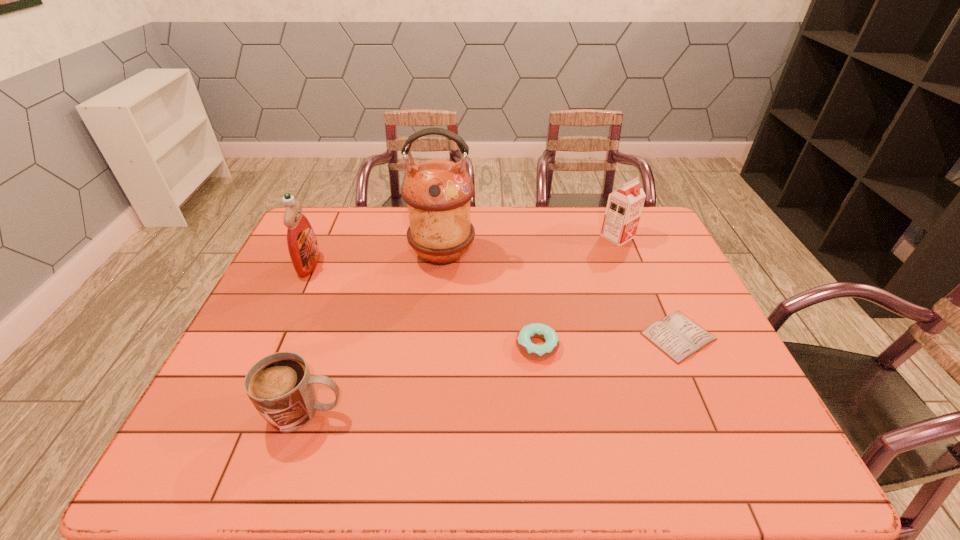
This screenshot has width=960, height=540. I want to click on object that can be found as the third closest to the fourth object from right to left, so click(280, 386).

The height and width of the screenshot is (540, 960). In order to click on vacant position in the image that satisfies the following two spatial constraints: 1. on the front surface of the doughnut; 2. on the left side of the leftmost object in this screenshot , I will do `click(271, 346)`.

Find the location of a particular element. free point that satisfies the following two spatial constraints: 1. on the front surface of the detergent; 2. on the left side of the shortest object is located at coordinates (276, 336).

This screenshot has height=540, width=960. I want to click on vacant area in the image that satisfies the following two spatial constraints: 1. on the back side of the doughnut; 2. on the front surface of the detergent, so click(x=527, y=264).

Where is `free space that satisfies the following two spatial constraints: 1. on the front side of the fifth tallest object; 2. on the right side of the tallest object`? free space that satisfies the following two spatial constraints: 1. on the front side of the fifth tallest object; 2. on the right side of the tallest object is located at coordinates (433, 346).

This screenshot has width=960, height=540. I want to click on vacant point that satisfies the following two spatial constraints: 1. on the front surface of the third object from right to left; 2. on the right side of the leftmost object, so click(x=271, y=346).

This screenshot has width=960, height=540. I want to click on vacant space that satisfies the following two spatial constraints: 1. on the front surface of the third object from right to left; 2. on the left side of the detergent, so click(x=271, y=346).

The image size is (960, 540). Identify the location of free space that satisfies the following two spatial constraints: 1. on the front side of the third object from left to right; 2. on the side of the mug with the handle. (426, 411).